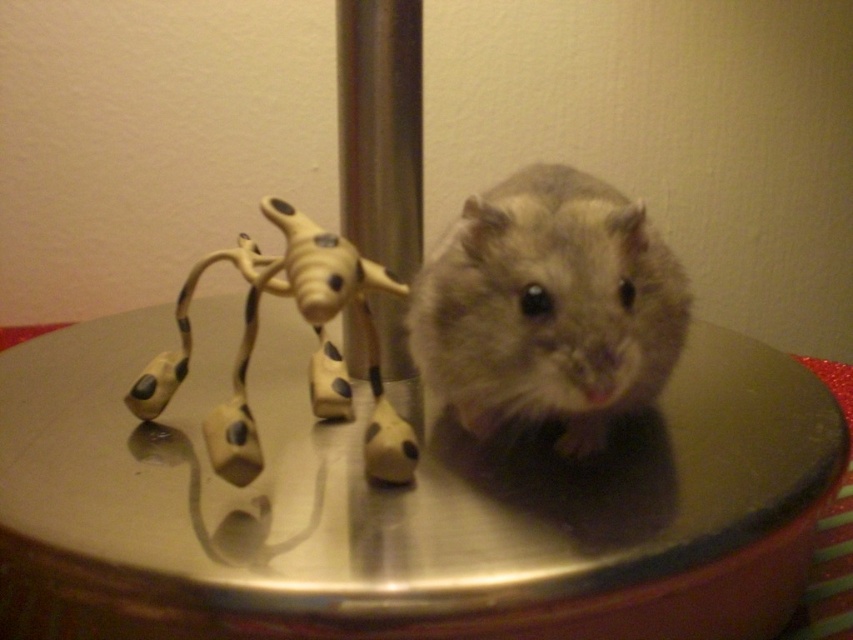
You are trying to determine if the fuzzy gray mouse at center can fit entirely under the tan matte plastic toy at left. Based on their sizes, what do you think?

The fuzzy gray mouse at center has a lesser width compared to the tan matte plastic toy at left, so it can fit entirely under the tan matte plastic toy at left.

You are looking at the image and want to place a sticker on the closest point between the two points marked as point (606, 323) and point (381, 452). Which point should you choose?

Point (606, 323) is closer to the viewer than point (381, 452), so you should choose point (606, 323).

You are a photographer trying to capture the hamster in the image. The hamster is currently at the point labeled as point (x=548, y=307). If you want to move the hamster to the left to be closer to the giraffe toy, which direction should you move it?

The point (x=548, y=307) indicates the fuzzy gray mouse at center. To move the hamster closer to the giraffe toy on the left, you should move it to the left.